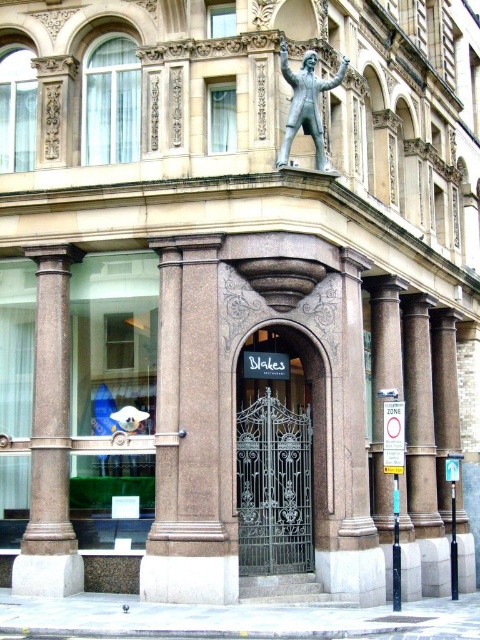
You are standing in front of the grand building and want to take a photo. You notice two points marked on the building facade at coordinates point (64, 461) and point (307, 102). Which point is closer to your camera when taking the photo?

Point (64, 461) is further to the camera than point (307, 102), so point (307, 102) is closer to the camera.

You are standing at the entrance of Blakes restaurant and want to take a photo of the sanded stone column at center. Where should you position yourself to capture it in the frame?

The sanded stone column at center is located at point (x=188, y=435), so you should position yourself facing that coordinate to capture it in the frame.